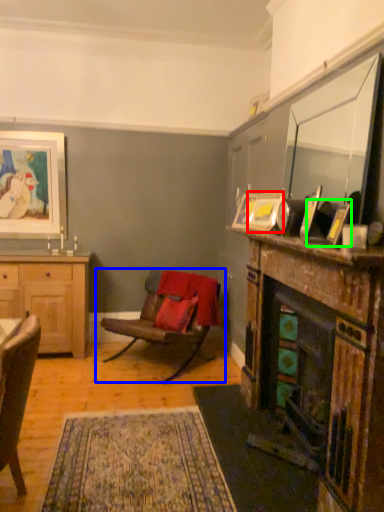
Question: Which is farther away from picture frame (highlighted by a red box)? chair (highlighted by a blue box) or picture frame (highlighted by a green box)?

Choices:
 (A) chair
 (B) picture frame

Answer: (A)